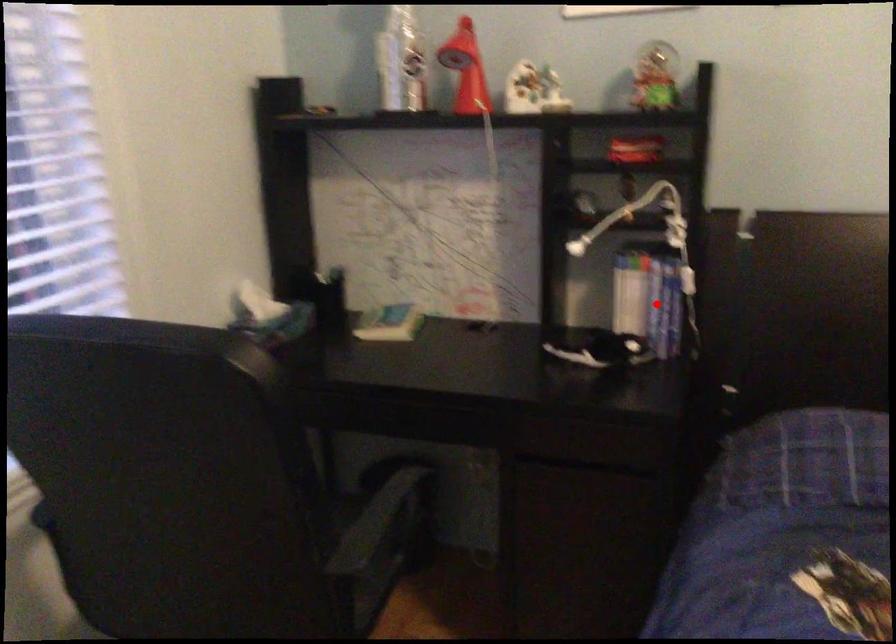
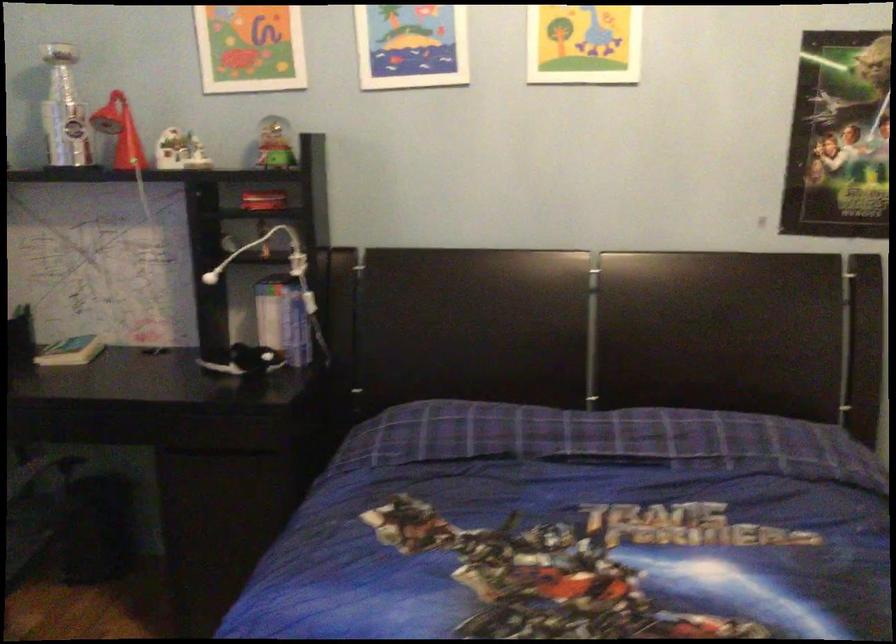
Question: A red point is marked in image1. In image2, is the corresponding 3D point closer to the camera or farther? Reply with the corresponding letter.

Choices:
 (A) The corresponding 3D point is closer.
 (B) The corresponding 3D point is farther.

Answer: (B)